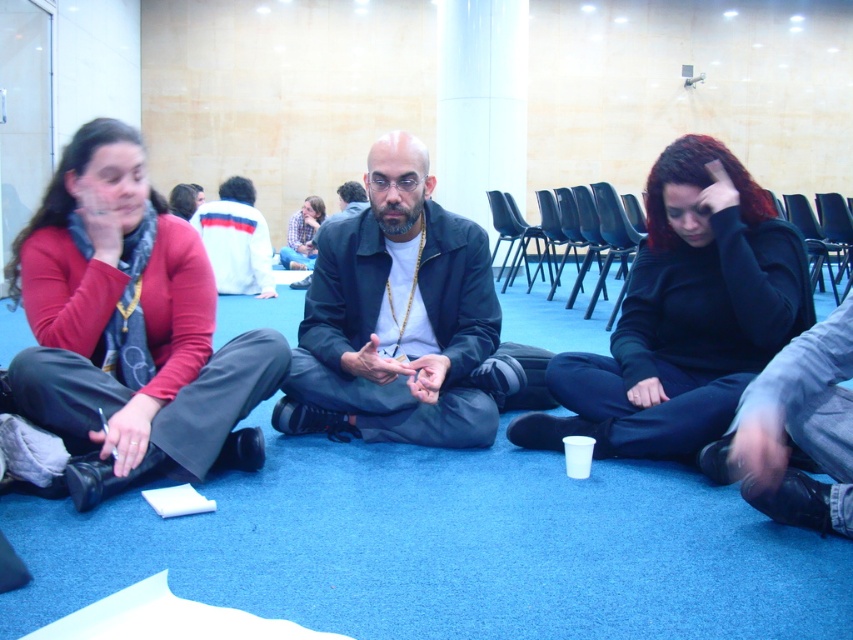
Which is above, matte red sweater at left or black matte hoodie at center?

matte red sweater at left is above.

Between point (39, 307) and point (570, 371), which one is positioned in front?

Point (39, 307) is more forward.

Is point (108, 224) closer to viewer compared to point (712, 196)?

Yes, it is.

Locate an element on the screen. The height and width of the screenshot is (640, 853). matte red sweater at left is located at coordinates (129, 328).

Is the position of black matte hoodie at center less distant than that of black matte jacket at center?

Yes.

In the scene shown: Is black matte hoodie at center to the left of black matte jacket at center from the viewer's perspective?

Incorrect, black matte hoodie at center is not on the left side of black matte jacket at center.

This screenshot has width=853, height=640. What do you see at coordinates (682, 317) in the screenshot?
I see `black matte hoodie at center` at bounding box center [682, 317].

Find the location of a particular element. The image size is (853, 640). black matte hoodie at center is located at coordinates (682, 317).

The height and width of the screenshot is (640, 853). Find the location of `black matte jacket at center`. black matte jacket at center is located at coordinates (396, 317).

Is black matte jacket at center positioned behind white cotton jacket at upper center?

No, black matte jacket at center is closer to the viewer.

Is point (442, 396) in front of point (236, 259)?

Yes, point (442, 396) is closer to viewer.

The height and width of the screenshot is (640, 853). Identify the location of black matte jacket at center. (396, 317).